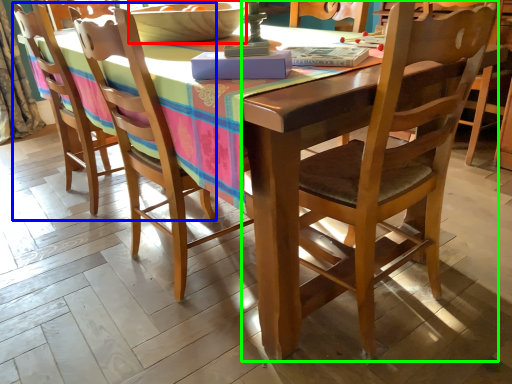
Question: Estimate the real-world distances between objects in this image. Which object is farther from bowl (highlighted by a red box), chair (highlighted by a blue box) or chair (highlighted by a green box)?

Choices:
 (A) chair
 (B) chair

Answer: (B)